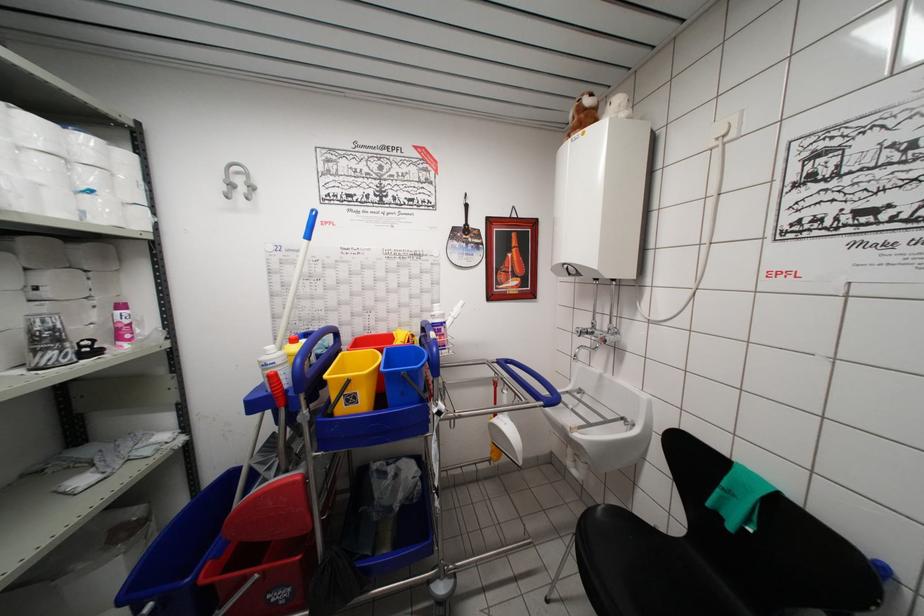
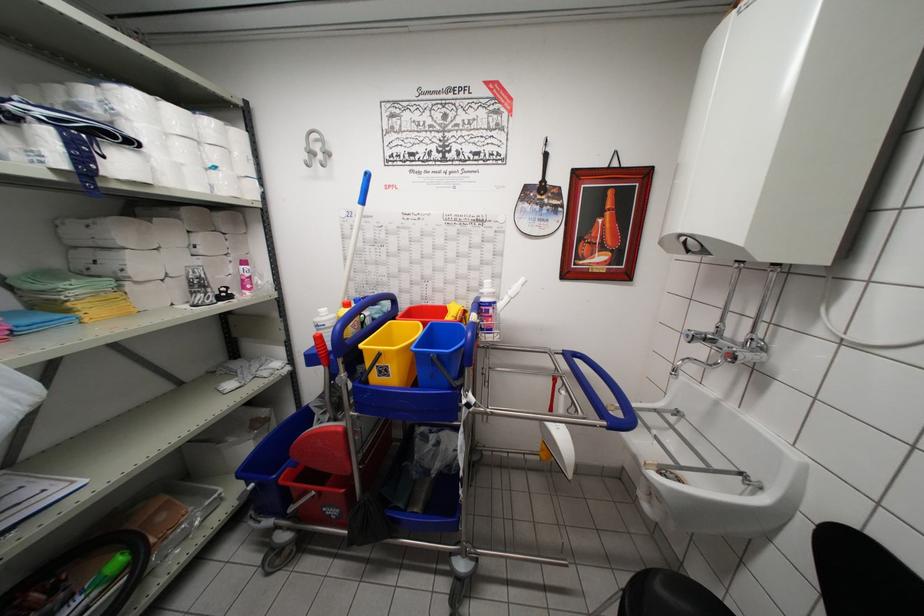
Question: Based on the continuous images, in which direction is the camera rotating? Reply with the corresponding letter.

Choices:
 (A) Left
 (B) Right
 (C) Up
 (D) Down

Answer: (A)